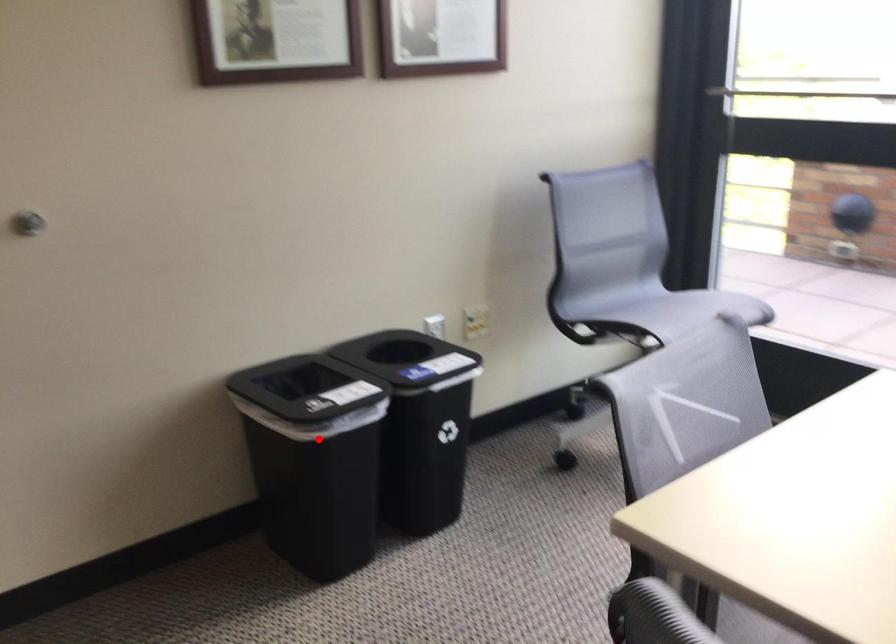
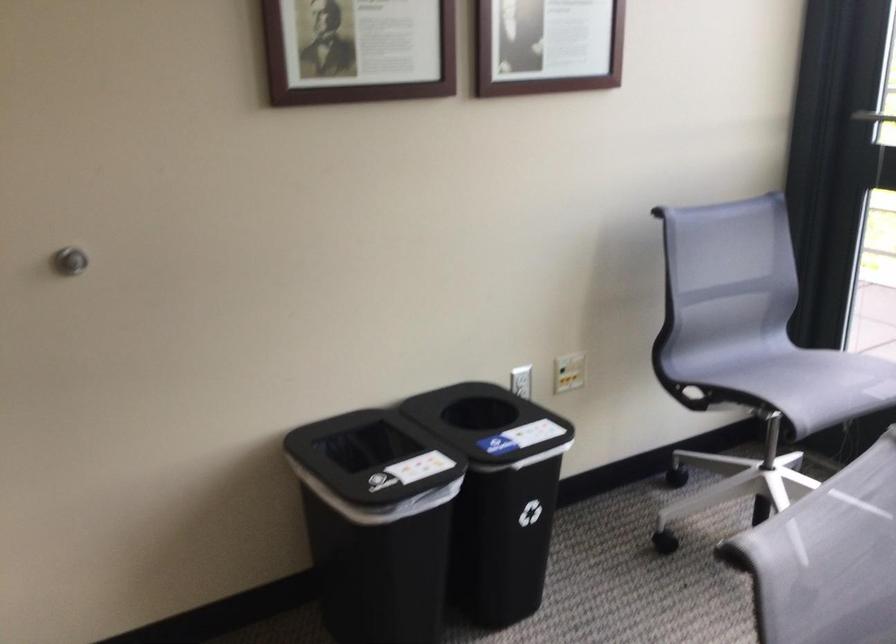
In the second image, find the point that corresponds to the highlighted location in the first image.

(376, 522)